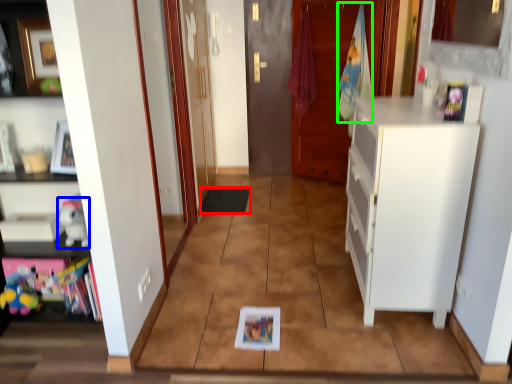
Question: Based on their relative distances, which object is farther from mat (highlighted by a red box)? Choose from toy (highlighted by a blue box) and laundry (highlighted by a green box).

Choices:
 (A) toy
 (B) laundry

Answer: (A)